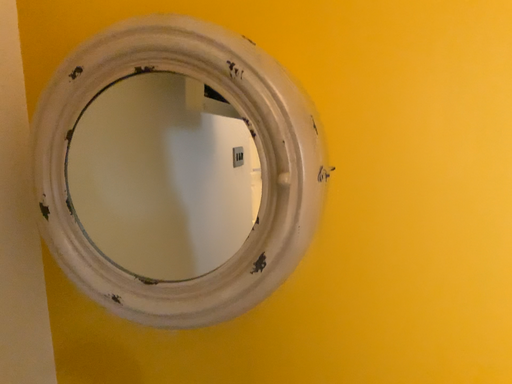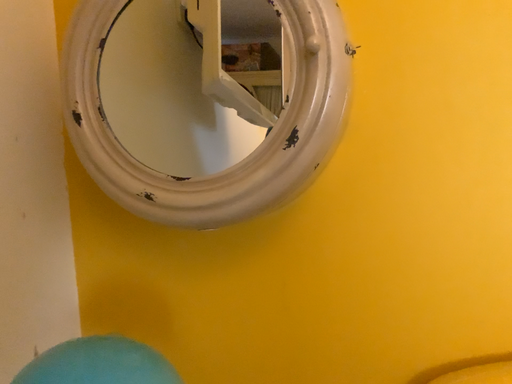
Question: Which way did the camera rotate in the video?

Choices:
 (A) rotated upward
 (B) rotated downward

Answer: (A)